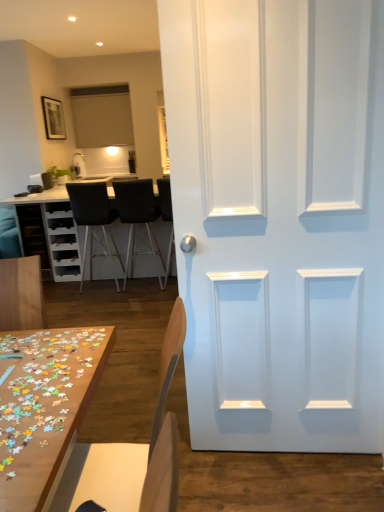
The height and width of the screenshot is (512, 384). Identify the location of white matte door at center. (279, 219).

What do you see at coordinates (125, 443) in the screenshot? This screenshot has height=512, width=384. I see `light brown wood chair at lower center, which is counted as the 1th chair, starting from the front` at bounding box center [125, 443].

Where is `light brown wood chair at lower center, which is counted as the 1th chair, starting from the front`? light brown wood chair at lower center, which is counted as the 1th chair, starting from the front is located at coordinates (125, 443).

Where is `black fabric chair at center, acting as the second chair starting from the back`? The width and height of the screenshot is (384, 512). black fabric chair at center, acting as the second chair starting from the back is located at coordinates (138, 218).

Locate an element on the screen. black leather chair at center, which ranks as the third chair in back-to-front order is located at coordinates (166, 216).

Find the location of a particular element. The image size is (384, 512). black leather chair at center, marked as the 4th chair in a front-to-back arrangement is located at coordinates (94, 220).

This screenshot has width=384, height=512. Find the location of `white matte door at center`. white matte door at center is located at coordinates (279, 219).

Is wooden puzzle pieces at lower left, which appears as the 2th table when viewed from the left, outside of black leather chair at center, which ranks as the third chair in back-to-front order?

That's correct, wooden puzzle pieces at lower left, which appears as the 2th table when viewed from the left, is outside of black leather chair at center, which ranks as the third chair in back-to-front order.

Based on the photo, is wooden puzzle pieces at lower left, which appears as the 2th table when viewed from the left, not close to black leather chair at center, the 2th chair when ordered from front to back?

wooden puzzle pieces at lower left, which appears as the 2th table when viewed from the left, is far away from black leather chair at center, the 2th chair when ordered from front to back.

Between wooden puzzle pieces at lower left, which appears as the 2th table when viewed from the left, and black leather chair at center, the 2th chair when ordered from front to back, which one has larger size?

black leather chair at center, the 2th chair when ordered from front to back, is bigger.

Considering the positions of point (42, 344) and point (162, 206), is point (42, 344) closer or farther from the camera than point (162, 206)?

Point (42, 344).

Is light brown wood chair at lower center, which is counted as the 4th chair, starting from the back, with wooden puzzle pieces at lower left, arranged as the first table when viewed from the front?

No, light brown wood chair at lower center, which is counted as the 4th chair, starting from the back, is not beside wooden puzzle pieces at lower left, arranged as the first table when viewed from the front.

Which of these two, light brown wood chair at lower center, which is counted as the 1th chair, starting from the front, or wooden puzzle pieces at lower left, acting as the second table starting from the back, is thinner?

Thinner between the two is wooden puzzle pieces at lower left, acting as the second table starting from the back.

From the image's perspective, is light brown wood chair at lower center, which is counted as the 1th chair, starting from the front, located beneath wooden puzzle pieces at lower left, the 2th table from the top?

Correct, light brown wood chair at lower center, which is counted as the 1th chair, starting from the front, appears lower than wooden puzzle pieces at lower left, the 2th table from the top, in the image.

Looking at this image, is light brown wood chair at lower center, which is counted as the 4th chair, starting from the back, not within wooden puzzle pieces at lower left, acting as the second table starting from the back?

light brown wood chair at lower center, which is counted as the 4th chair, starting from the back, lies outside wooden puzzle pieces at lower left, acting as the second table starting from the back,'s area.

Is black fabric chair at center, acting as the second chair starting from the back, placed right next to white matte door at center?

No, black fabric chair at center, acting as the second chair starting from the back, is not touching white matte door at center.

Visually, is black fabric chair at center, arranged as the third chair when viewed from the front, positioned to the left or to the right of white matte door at center?

black fabric chair at center, arranged as the third chair when viewed from the front, is to the left of white matte door at center.

Between point (150, 237) and point (323, 312), which one is positioned in front?

The point (323, 312) is closer.

Where is `the 4th chair positioned below the white matte door at center (from a real-world perspective)`? the 4th chair positioned below the white matte door at center (from a real-world perspective) is located at coordinates (138, 218).

Is black leather chair at center, the 2th chair when ordered from front to back, situated inside wooden puzzle pieces at lower left, acting as the second table starting from the back, or outside?

black leather chair at center, the 2th chair when ordered from front to back, is outside wooden puzzle pieces at lower left, acting as the second table starting from the back.

Could you tell me if black leather chair at center, which ranks as the third chair in back-to-front order, is facing wooden puzzle pieces at lower left, acting as the second table starting from the back?

No, black leather chair at center, which ranks as the third chair in back-to-front order, is not turned towards wooden puzzle pieces at lower left, acting as the second table starting from the back.

Which is more to the left, black leather chair at center, which ranks as the third chair in back-to-front order, or wooden puzzle pieces at lower left, the 2th table from the top?

From the viewer's perspective, wooden puzzle pieces at lower left, the 2th table from the top, appears more on the left side.

Can light brown wood chair at lower center, which is counted as the 1th chair, starting from the front, be found inside black leather chair at center, marked as the 4th chair in a front-to-back arrangement?

No, light brown wood chair at lower center, which is counted as the 1th chair, starting from the front, is not inside black leather chair at center, marked as the 4th chair in a front-to-back arrangement.

Considering the relative sizes of black leather chair at center, acting as the 1th chair starting from the back, and light brown wood chair at lower center, which is counted as the 4th chair, starting from the back, in the image provided, is black leather chair at center, acting as the 1th chair starting from the back, shorter than light brown wood chair at lower center, which is counted as the 4th chair, starting from the back,?

In fact, black leather chair at center, acting as the 1th chair starting from the back, may be taller than light brown wood chair at lower center, which is counted as the 4th chair, starting from the back.

Identify the location of the 3rd chair in front when counting from the black leather chair at center, acting as the 1th chair starting from the back. The image size is (384, 512). (125, 443).

From a real-world perspective, who is located lower, black leather chair at center, marked as the 4th chair in a front-to-back arrangement, or light brown wood chair at lower center, which is counted as the 4th chair, starting from the back?

From a 3D spatial view, black leather chair at center, marked as the 4th chair in a front-to-back arrangement, is below.

Which is more to the right, matte black cabinet at left or light brown wood chair at lower center, which is counted as the 4th chair, starting from the back?

Positioned to the right is light brown wood chair at lower center, which is counted as the 4th chair, starting from the back.

Looking at this image, which of these two, matte black cabinet at left or light brown wood chair at lower center, which is counted as the 1th chair, starting from the front, stands shorter?

With less height is matte black cabinet at left.

Considering the sizes of matte black cabinet at left and light brown wood chair at lower center, which is counted as the 4th chair, starting from the back, in the image, is matte black cabinet at left bigger or smaller than light brown wood chair at lower center, which is counted as the 4th chair, starting from the back,?

Clearly, matte black cabinet at left is smaller in size than light brown wood chair at lower center, which is counted as the 4th chair, starting from the back.

Is light brown wood chair at lower center, which is counted as the 4th chair, starting from the back, located within matte black cabinet at left?

No, light brown wood chair at lower center, which is counted as the 4th chair, starting from the back, is not surrounded by matte black cabinet at left.

Is black fabric chair at center, arranged as the third chair when viewed from the front, looking in the opposite direction of light brown wood chair at lower center, which is counted as the 4th chair, starting from the back?

Yes.

How much distance is there between black fabric chair at center, arranged as the third chair when viewed from the front, and light brown wood chair at lower center, which is counted as the 4th chair, starting from the back?

2.77 meters.

From a real-world perspective, is black fabric chair at center, acting as the second chair starting from the back, over light brown wood chair at lower center, which is counted as the 1th chair, starting from the front?

Actually, black fabric chair at center, acting as the second chair starting from the back, is physically below light brown wood chair at lower center, which is counted as the 1th chair, starting from the front, in the real world.

Looking at the image, does black fabric chair at center, acting as the second chair starting from the back, seem bigger or smaller compared to light brown wood chair at lower center, which is counted as the 1th chair, starting from the front?

In the image, black fabric chair at center, acting as the second chair starting from the back, appears to be larger than light brown wood chair at lower center, which is counted as the 1th chair, starting from the front.

Locate an element on the screen. This screenshot has height=512, width=384. table that is the 1st object to the left of the black leather chair at center, the 2th chair when ordered from front to back, starting at the anchor is located at coordinates (44, 406).

Find the location of a particular element. The image size is (384, 512). the 1st table above when counting from the light brown wood chair at lower center, which is counted as the 1th chair, starting from the front (from the image's perspective) is located at coordinates (44, 406).

When comparing their distances from black leather chair at center, acting as the 1th chair starting from the back, does black fabric chair at center, acting as the second chair starting from the back, or wooden puzzle pieces at lower left, the 2th table from the top, seem further?

The object further to black leather chair at center, acting as the 1th chair starting from the back, is wooden puzzle pieces at lower left, the 2th table from the top.

Estimate the real-world distances between objects in this image. Which object is further from black fabric chair at center, acting as the second chair starting from the back, black leather chair at center, marked as the 4th chair in a front-to-back arrangement, or white glossy table at upper left, which is the second table from front to back?

white glossy table at upper left, which is the second table from front to back, is further to black fabric chair at center, acting as the second chair starting from the back.

Looking at the image, which one is located closer to black leather chair at center, the 2th chair when ordered from front to back, white glossy table at upper left, the second table in the right-to-left sequence, or black leather chair at center, marked as the 4th chair in a front-to-back arrangement?

black leather chair at center, marked as the 4th chair in a front-to-back arrangement, is positioned closer to the anchor black leather chair at center, the 2th chair when ordered from front to back.

Considering their positions, is wooden puzzle pieces at lower left, acting as the second table starting from the back, positioned closer to white glossy table at upper left, which is the 1th table from top to bottom, than black fabric chair at center, acting as the second chair starting from the back?

black fabric chair at center, acting as the second chair starting from the back, is closer to white glossy table at upper left, which is the 1th table from top to bottom.

Which object lies further to the anchor point black leather chair at center, which ranks as the third chair in back-to-front order, matte black cabinet at left or black fabric chair at center, arranged as the third chair when viewed from the front?

Based on the image, matte black cabinet at left appears to be further to black leather chair at center, which ranks as the third chair in back-to-front order.

Which object lies further to the anchor point black leather chair at center, acting as the 1th chair starting from the back, black fabric chair at center, acting as the second chair starting from the back, or matte black cabinet at left?

matte black cabinet at left.

Looking at the image, which one is located further to white matte door at center, black leather chair at center, the 2th chair when ordered from front to back, or matte black cabinet at left?

Among the two, matte black cabinet at left is located further to white matte door at center.

Considering their positions, is black fabric chair at center, arranged as the third chair when viewed from the front, positioned further to wooden puzzle pieces at lower left, placed as the 1th table when sorted from right to left, than white glossy table at upper left, which is the 1th table from top to bottom?

white glossy table at upper left, which is the 1th table from top to bottom, lies further to wooden puzzle pieces at lower left, placed as the 1th table when sorted from right to left, than the other object.

The width and height of the screenshot is (384, 512). What are the coordinates of `table positioned between light brown wood chair at lower center, which is counted as the 1th chair, starting from the front, and white glossy table at upper left, which is the second table from front to back, from near to far` in the screenshot? It's located at (44, 406).

Find the location of a particular element. table located between light brown wood chair at lower center, which is counted as the 1th chair, starting from the front, and black fabric chair at center, acting as the second chair starting from the back, in the depth direction is located at coordinates (44, 406).

The image size is (384, 512). I want to click on door between light brown wood chair at lower center, which is counted as the 1th chair, starting from the front, and matte black cabinet at left from front to back, so click(x=279, y=219).

Image resolution: width=384 pixels, height=512 pixels. I want to click on door between wooden puzzle pieces at lower left, acting as the second table starting from the back, and black leather chair at center, the 2th chair when ordered from front to back, from front to back, so click(x=279, y=219).